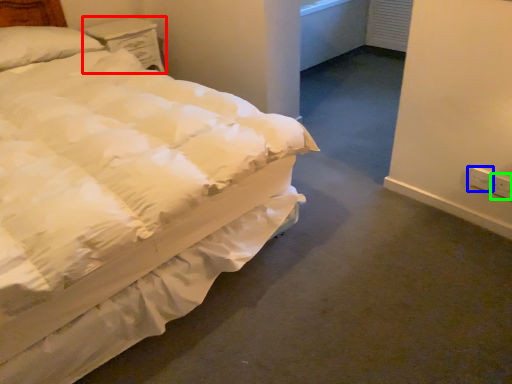
Question: Which object is positioned closest to nightstand (highlighted by a red box)? Select from electric outlet (highlighted by a blue box) and electric outlet (highlighted by a green box).

Choices:
 (A) electric outlet
 (B) electric outlet

Answer: (A)